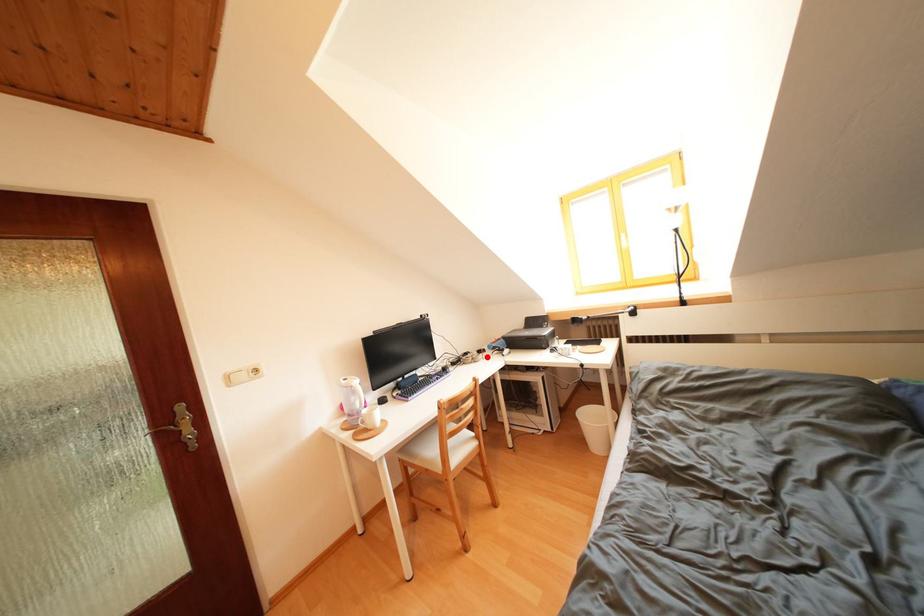
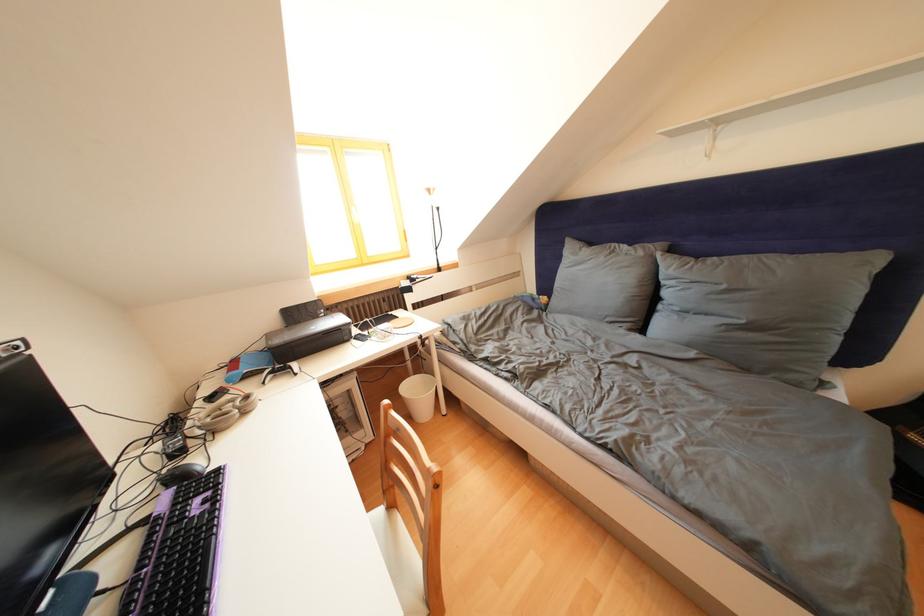
Find the pixel in the second image that matches the highlighted location in the first image.

(220, 403)